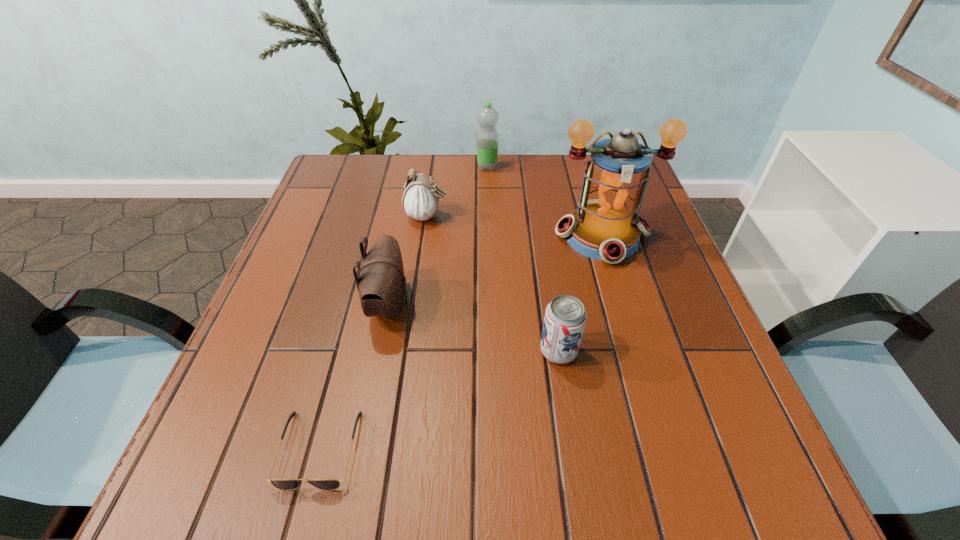
Image resolution: width=960 pixels, height=540 pixels. I want to click on vacant region located 0.200m with the flap open on the nearer pouch, so click(508, 304).

I want to click on vacant region located on the front-facing side of the farther pouch, so click(x=606, y=216).

Where is `vacant area situated on the back of the beer can`? vacant area situated on the back of the beer can is located at coordinates (544, 259).

At what (x,y) coordinates should I click in order to perform the action: click on object that is positioned at the far edge. Please return your answer as a coordinate pair (x, y). This screenshot has height=540, width=960. Looking at the image, I should click on (487, 138).

In order to click on object situated at the near edge in this screenshot , I will do `click(283, 484)`.

Locate an element on the screen. object present at the left edge is located at coordinates (283, 484).

This screenshot has width=960, height=540. In order to click on object present at the right edge in this screenshot , I will do `click(606, 226)`.

This screenshot has height=540, width=960. I want to click on object positioned at the near left corner, so click(283, 484).

Find the location of `free spot at the far edge of the desktop`. free spot at the far edge of the desktop is located at coordinates (540, 190).

Image resolution: width=960 pixels, height=540 pixels. I want to click on vacant space at the near edge of the desktop, so (x=323, y=465).